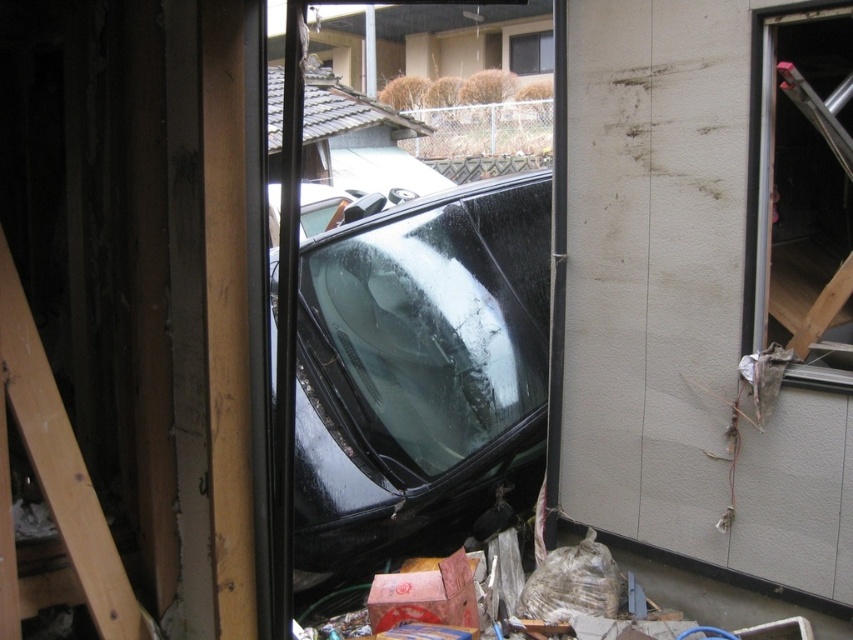
Is point (403, 385) behind point (532, 68)?

No, (403, 385) is closer to viewer.

I want to click on glossy black windshield at center, so click(x=428, y=330).

Consider the image. Which of these two, glossy black windshield at center or wooden at left, stands shorter?

wooden at left is shorter.

Which is below, glossy black windshield at center or wooden at left?

wooden at left is below.

Who is more forward, [347,324] or [6,548]?

Point [6,548] is in front.

You are a GUI agent. You are given a task and a screenshot of the screen. Output one action in this format:
    pyautogui.click(x=<x>, y=<y>)
    Task: Click on the glossy black windshield at center
    
    Given the screenshot: What is the action you would take?
    pyautogui.click(x=428, y=330)

Is glossy black windshield at center to the left of transparent glass window at right from the viewer's perspective?

Indeed, glossy black windshield at center is positioned on the left side of transparent glass window at right.

Who is more forward, (480, 406) or (795, 300)?

Positioned in front is point (795, 300).

The height and width of the screenshot is (640, 853). Identify the location of glossy black windshield at center. (428, 330).